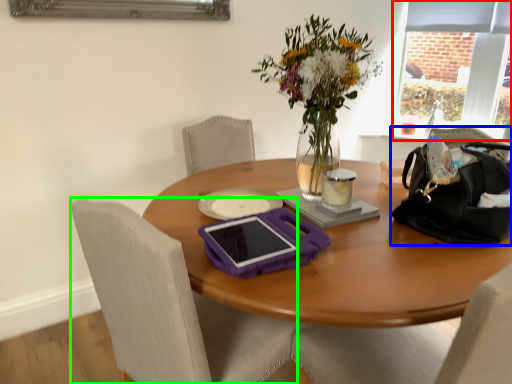
Question: Which is farther away from window screen (highlighted by a red box)? handbag (highlighted by a blue box) or chair (highlighted by a green box)?

Choices:
 (A) handbag
 (B) chair

Answer: (B)